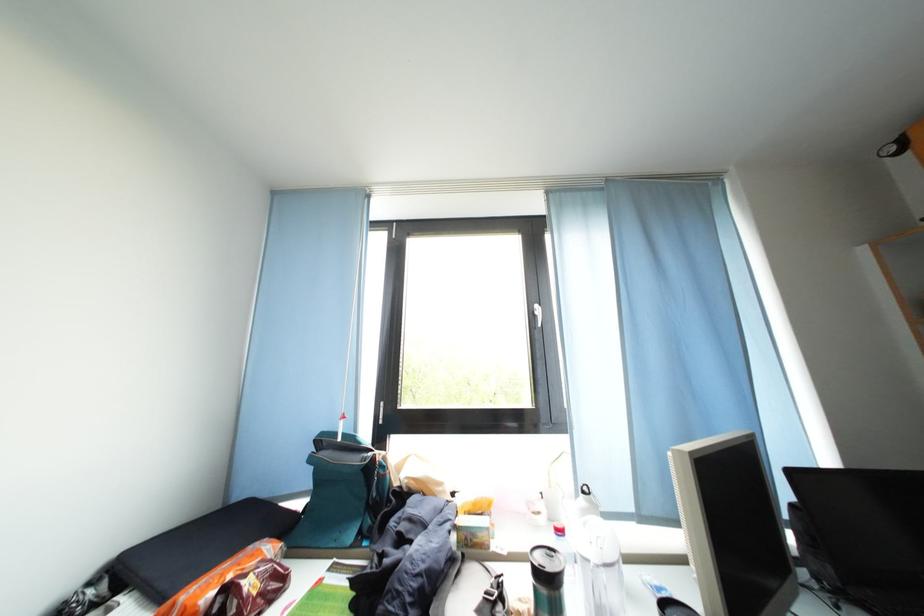
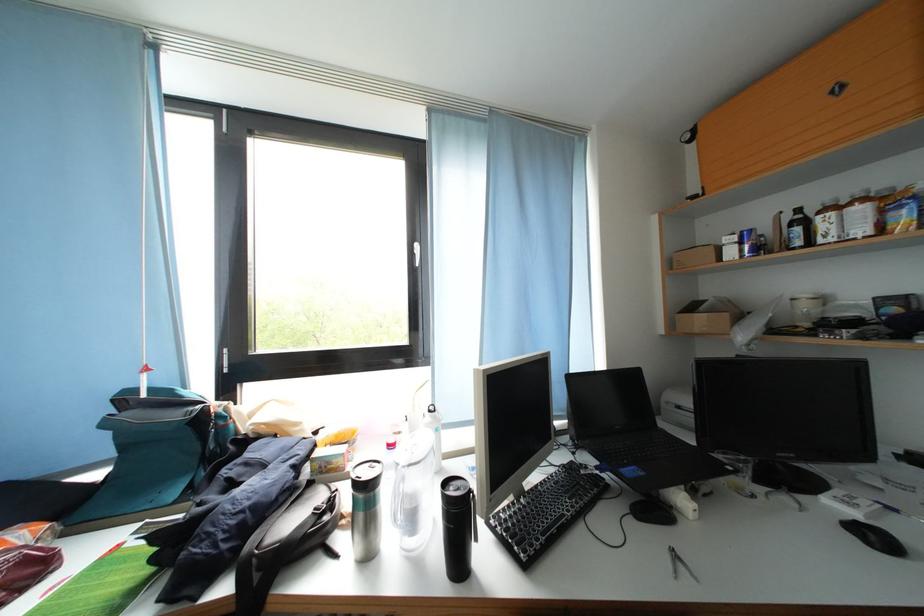
Locate, in the second image, the point that corresponds to (320,464) in the first image.

(114, 429)